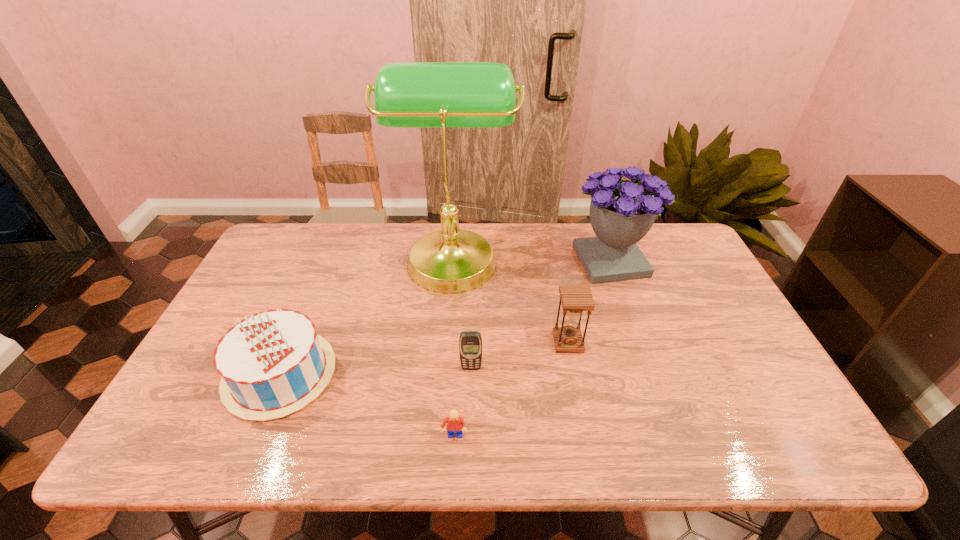
You are a GUI agent. You are given a task and a screenshot of the screen. Output one action in this format:
    pyautogui.click(x=<x>, y=<y>)
    Task: Click on the lamp
    The image size is (960, 540).
    Given the screenshot: What is the action you would take?
    pyautogui.click(x=406, y=94)

Locate an element on the screen. the fifth shortest object is located at coordinates (622, 212).

Locate an element on the screen. This screenshot has height=540, width=960. the rightmost object is located at coordinates (622, 212).

The height and width of the screenshot is (540, 960). I want to click on the fifth object from left to right, so click(575, 299).

The image size is (960, 540). Find the location of `the leftmost object`. the leftmost object is located at coordinates (272, 364).

Where is `the second shortest object`? Image resolution: width=960 pixels, height=540 pixels. the second shortest object is located at coordinates (470, 342).

Locate an element on the screen. This screenshot has width=960, height=540. the shortest object is located at coordinates (455, 423).

This screenshot has width=960, height=540. I want to click on the nearest object, so click(x=455, y=423).

Find the location of a particular element. This screenshot has width=960, height=540. free spot located 0.100m on the desk next to the lamp is located at coordinates (546, 256).

Locate an element on the screen. vacant space located 0.070m on the left of the bouquet is located at coordinates (548, 261).